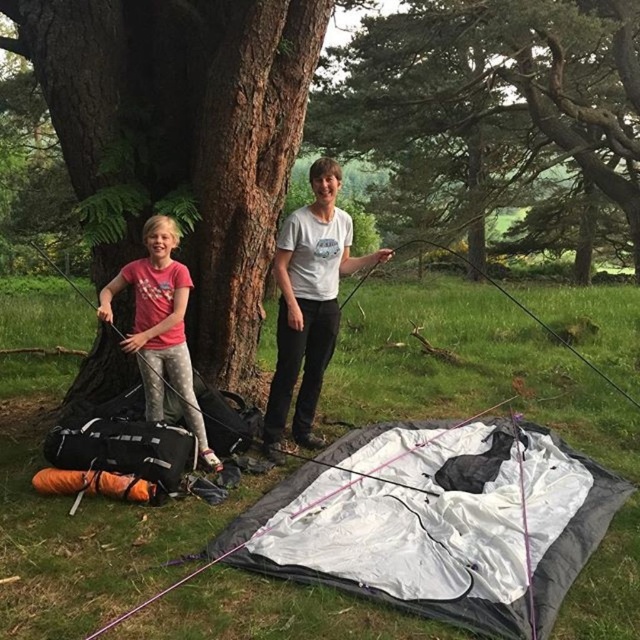
Question: Among these objects, which one is nearest to the camera?

Choices:
 (A) white cotton t-shirt at center
 (B) white fabric tent at lower center

Answer: (B)

Question: Does pink fabric shirt at left have a smaller size compared to orange fabric sleeping bag at lower left?

Choices:
 (A) no
 (B) yes

Answer: (A)

Question: Which object is the closest to the brown rough tree at center?

Choices:
 (A) green textured tree at center
 (B) pink fabric shirt at left

Answer: (B)

Question: Does green textured tree at center come in front of white fabric tent at lower center?

Choices:
 (A) yes
 (B) no

Answer: (B)

Question: Estimate the real-world distances between objects in this image. Which object is farther from the white fabric tent at lower center?

Choices:
 (A) brown rough tree at center
 (B) white cotton t-shirt at center

Answer: (A)

Question: In this image, where is white cotton t-shirt at center located relative to pink fabric shirt at left?

Choices:
 (A) left
 (B) right

Answer: (B)